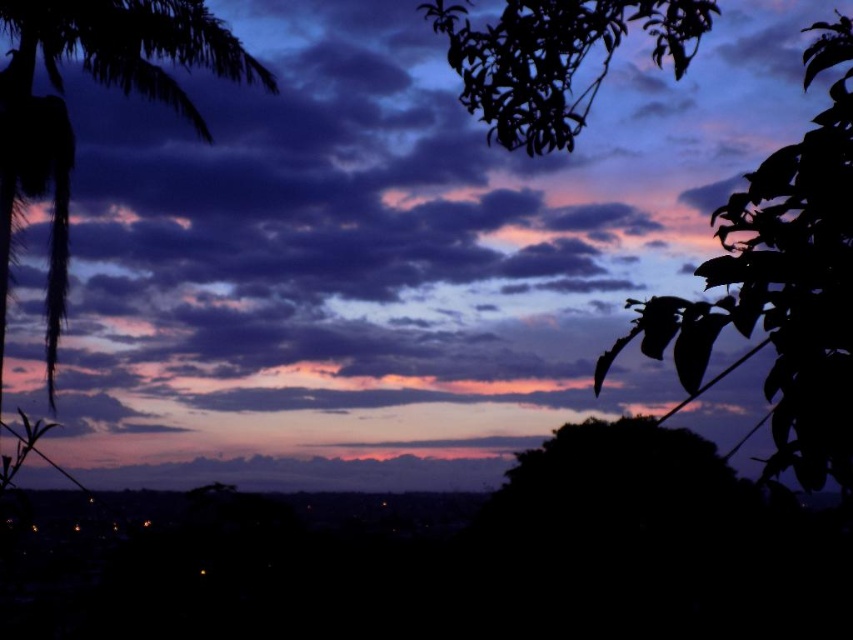
Question: Is silky black palm tree at left bigger than green leafy branch at upper right?

Choices:
 (A) no
 (B) yes

Answer: (B)

Question: Which object appears closest to the camera in this image?

Choices:
 (A) green leafy branch at upper right
 (B) silky black palm tree at left
 (C) silky dark leaves at upper right

Answer: (C)

Question: Considering the real-world distances, which object is closest to the green leafy branch at upper right?

Choices:
 (A) silky dark leaves at upper right
 (B) silky black palm tree at left

Answer: (A)

Question: Among these objects, which one is farthest from the camera?

Choices:
 (A) silky black palm tree at left
 (B) silky dark leaves at upper right
 (C) green leafy branch at upper right

Answer: (A)

Question: Where is silky dark leaves at upper right located in relation to green leafy branch at upper right in the image?

Choices:
 (A) above
 (B) below

Answer: (B)

Question: Can you confirm if silky black palm tree at left is positioned to the left of green leafy branch at upper right?

Choices:
 (A) yes
 (B) no

Answer: (A)